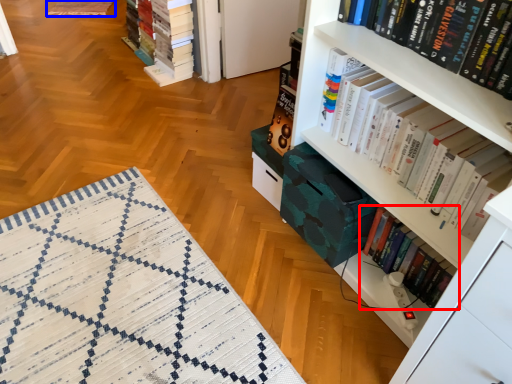
Question: Which of the following is the farthest to the observer, book (highlighted by a red box) or quilt (highlighted by a blue box)?

Choices:
 (A) book
 (B) quilt

Answer: (B)